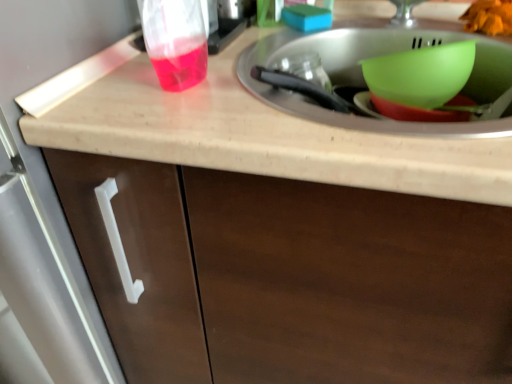
Identify the location of vacant space to the left of orange matte food at upper right. The image size is (512, 384). (419, 20).